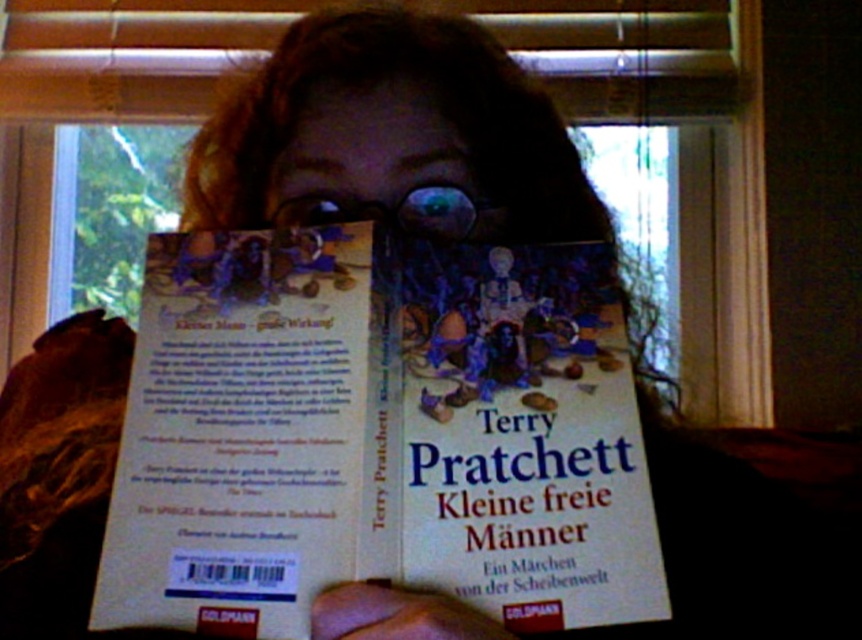
Question: Can you confirm if white paper at center is thinner than matte plastic face at center?

Choices:
 (A) yes
 (B) no

Answer: (B)

Question: Which object is closer to the camera taking this photo?

Choices:
 (A) matte plastic face at center
 (B) white paper at center

Answer: (B)

Question: From the image, what is the correct spatial relationship of white paper at center in relation to matte plastic face at center?

Choices:
 (A) left
 (B) right

Answer: (A)

Question: Where is white paper at center located in relation to matte plastic face at center in the image?

Choices:
 (A) below
 (B) above

Answer: (A)

Question: Which point is farther to the camera?

Choices:
 (A) white paper at center
 (B) matte plastic face at center

Answer: (B)